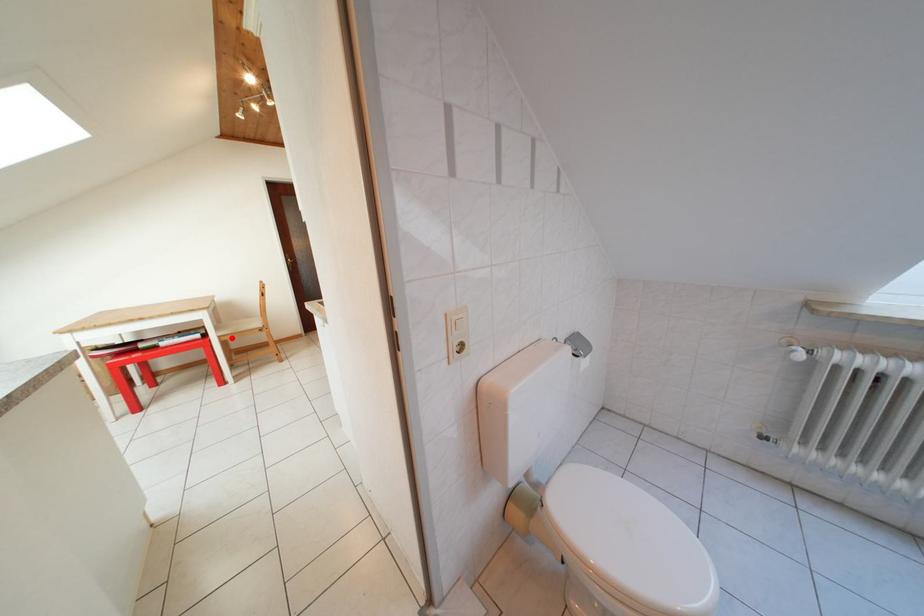
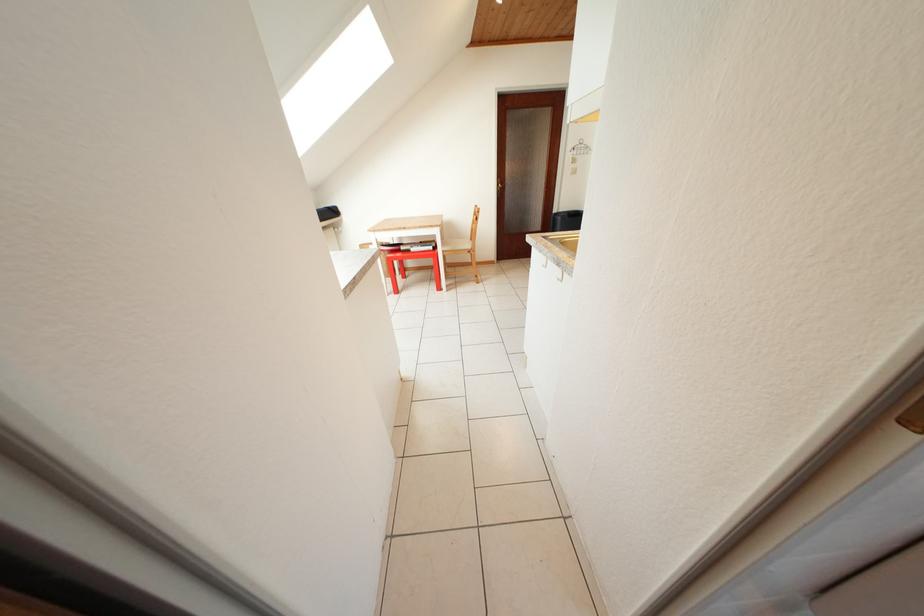
The point at the highlighted location is marked in the first image. Where is the corresponding point in the second image?

(454, 254)